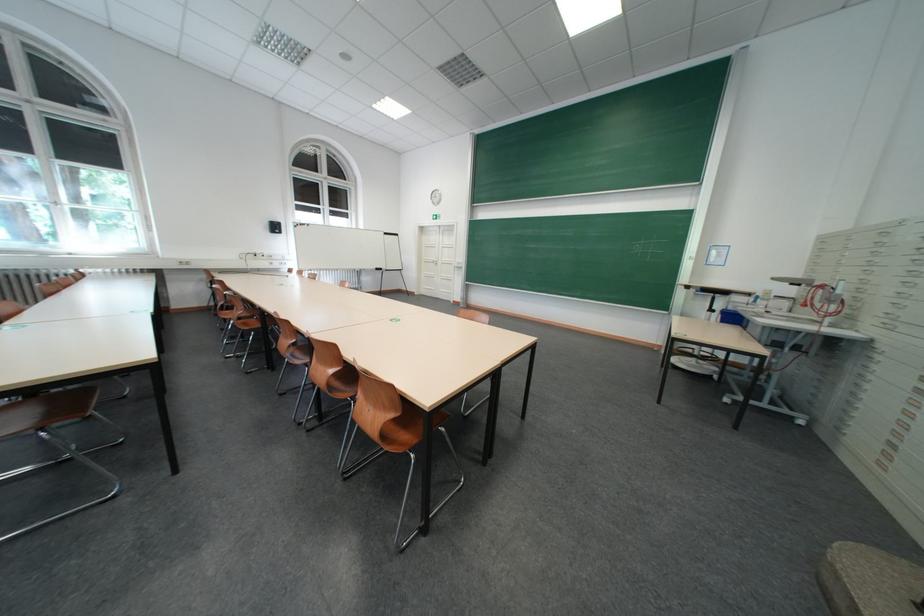
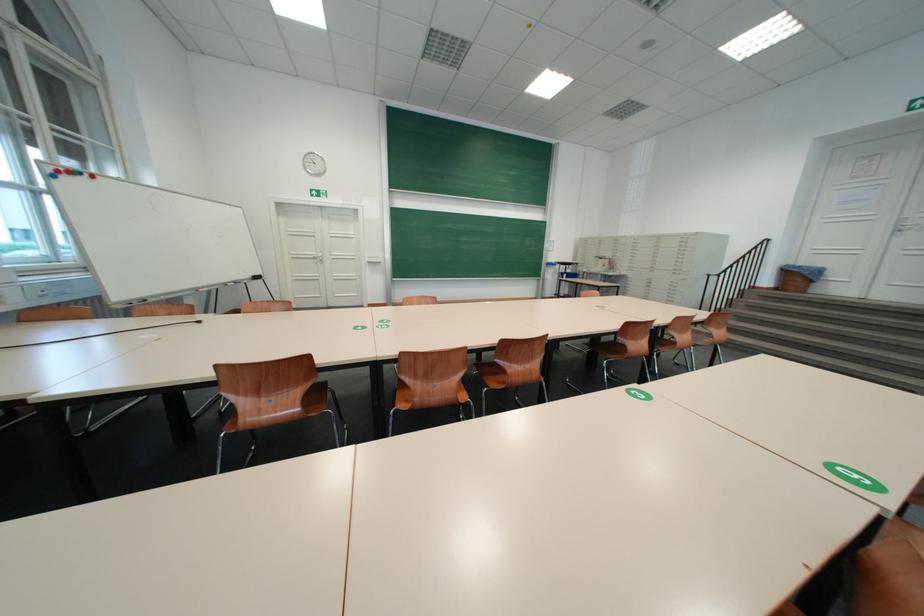
Find the pixel in the second image that matches pixel 315 225 in the first image.

(88, 175)